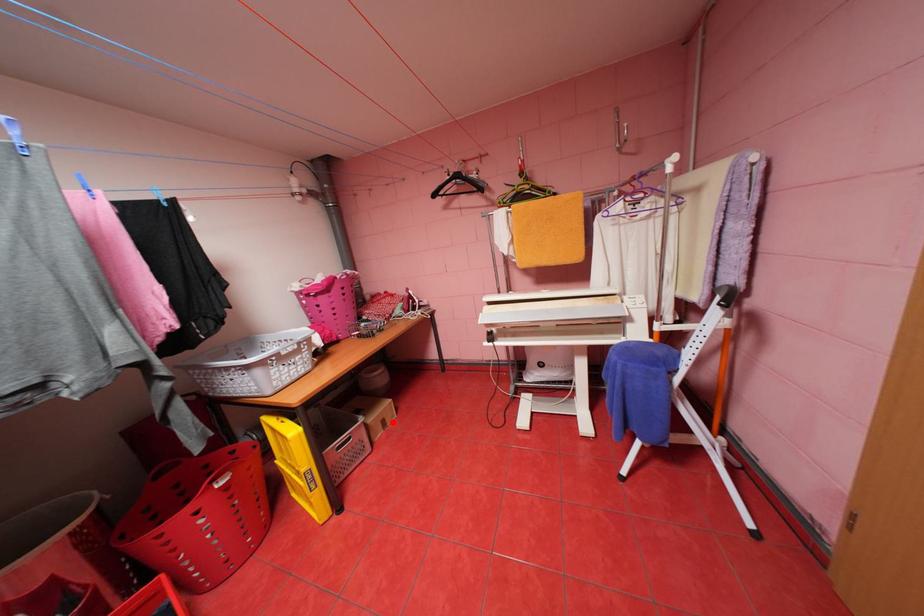
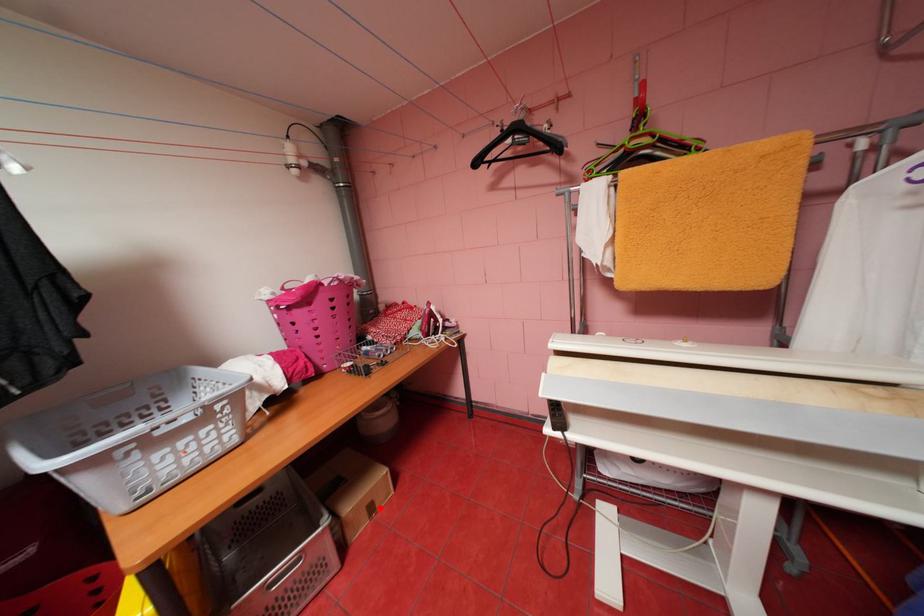
Based on the photo, I am providing you with two images of the same scene from different viewpoints. A red point is marked on the first image and another point is marked on the second image. Are the points marked in image1 and image2 representing the same 3D position?

Yes